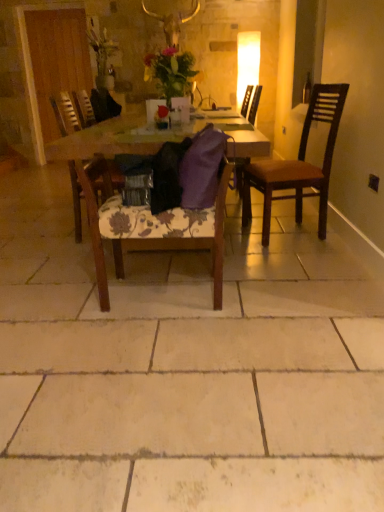
Image resolution: width=384 pixels, height=512 pixels. Identify the location of free spot in front of dark brown wood chair at right, the 3th chair positioned from the left. (298, 254).